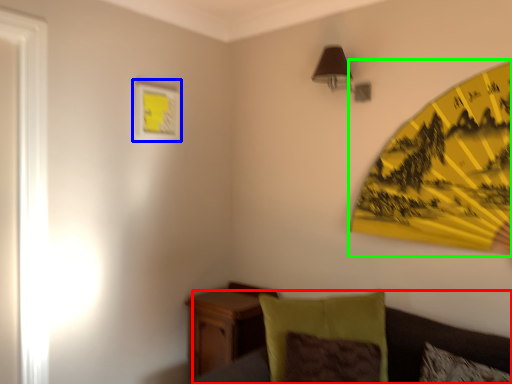
Question: Based on their relative distances, which object is nearer to couch (highlighted by a red box)? Choose from picture frame (highlighted by a blue box) and umbrella (highlighted by a green box).

Choices:
 (A) picture frame
 (B) umbrella

Answer: (A)